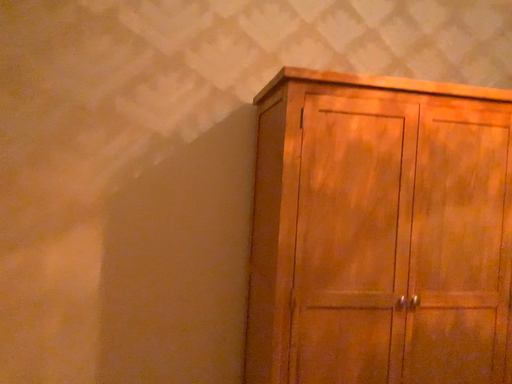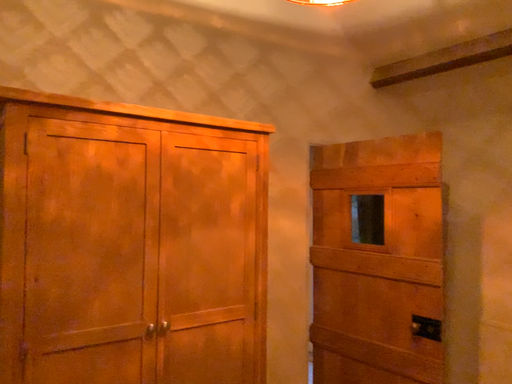
Question: How did the camera likely rotate when shooting the video?

Choices:
 (A) rotated right
 (B) rotated left

Answer: (A)